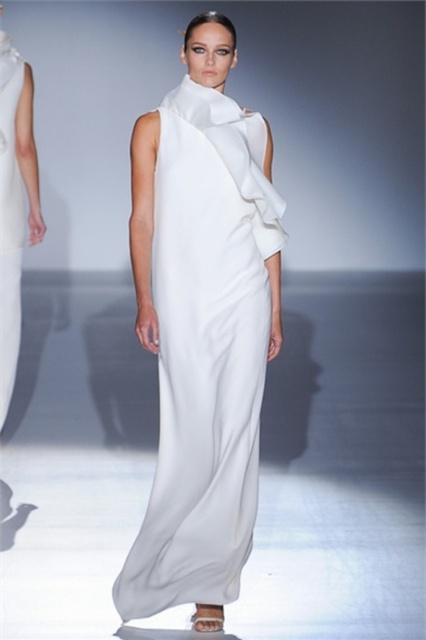
You are a fashion designer observing two dresses in the runway image. The white satin dress at center and the matte white dress at left. Which dress is taller?

The white satin dress at center is much taller than the matte white dress at left.

You are a photographer positioned at the front of the runway. You want to capture the model wearing the white satin dress at center in your shot. Given that the point representing the dress is at coordinates point (201,330), where should you aim your camera to ensure the dress is centered in the frame?

To center the white satin dress at center in your frame, aim your camera directly at the coordinates point (201,330), as this point represents the dress.